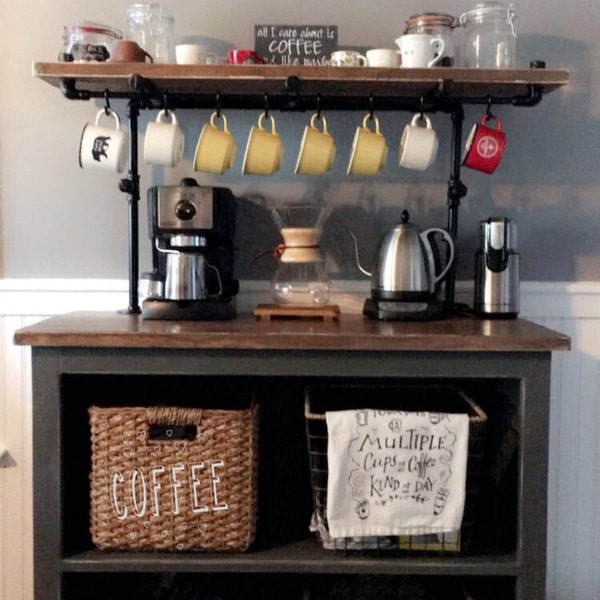
This screenshot has height=600, width=600. In order to click on coffee maker in this screenshot , I will do [x=223, y=230].